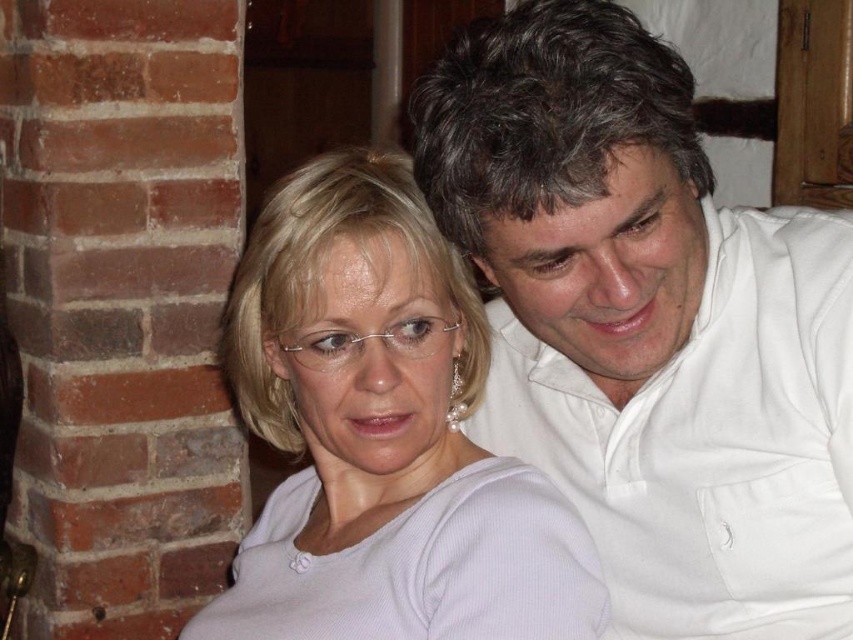
Is white smooth shirt at upper right above white matte shirt at center?

Yes.

The height and width of the screenshot is (640, 853). Describe the element at coordinates (648, 324) in the screenshot. I see `white smooth shirt at upper right` at that location.

This screenshot has width=853, height=640. Find the location of `white smooth shirt at upper right`. white smooth shirt at upper right is located at coordinates (648, 324).